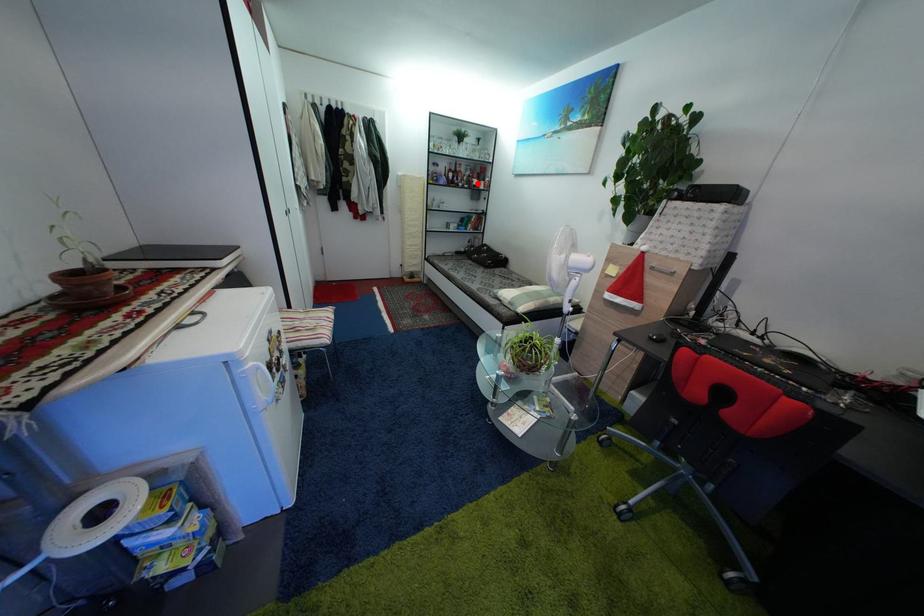
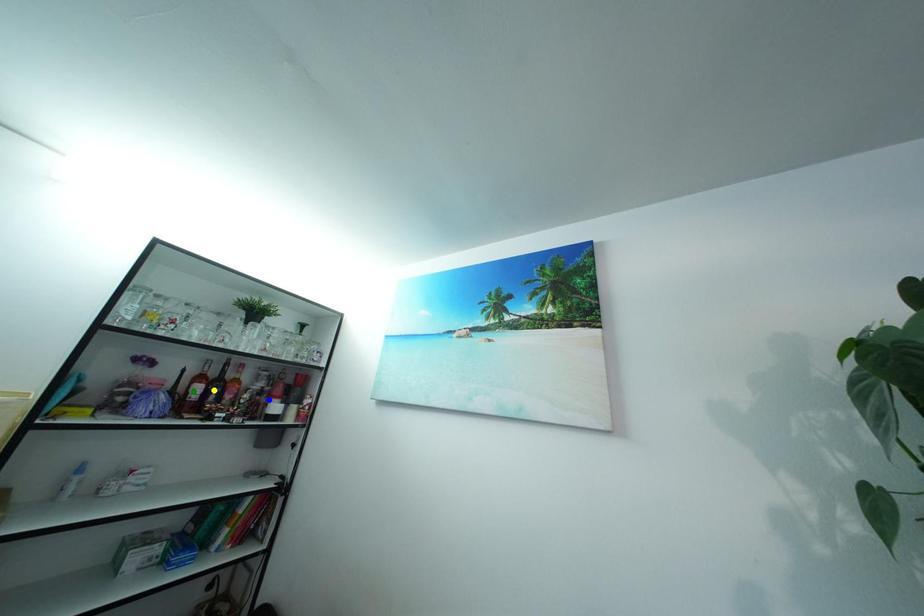
Question: I am providing you with two images of the same scene from different viewpoints. A red point is marked on the first image. You are given multiple points on the second image. Which point in image 2 represents the same 3d spot as the red point in image 1?

Choices:
 (A) blue point
 (B) yellow point
 (C) green point

Answer: (A)